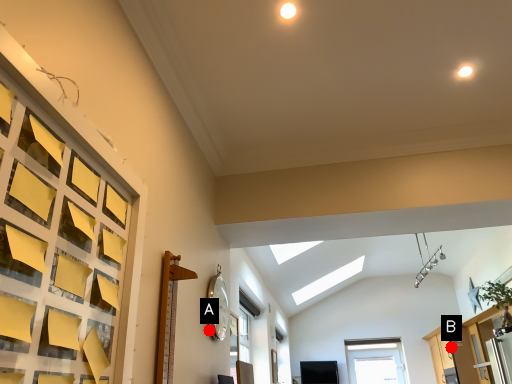
Question: Two points are circled on the image, labeled by A and B beside each circle. Which point is farther from the camera taking this photo?

Choices:
 (A) A is further
 (B) B is further

Answer: (B)